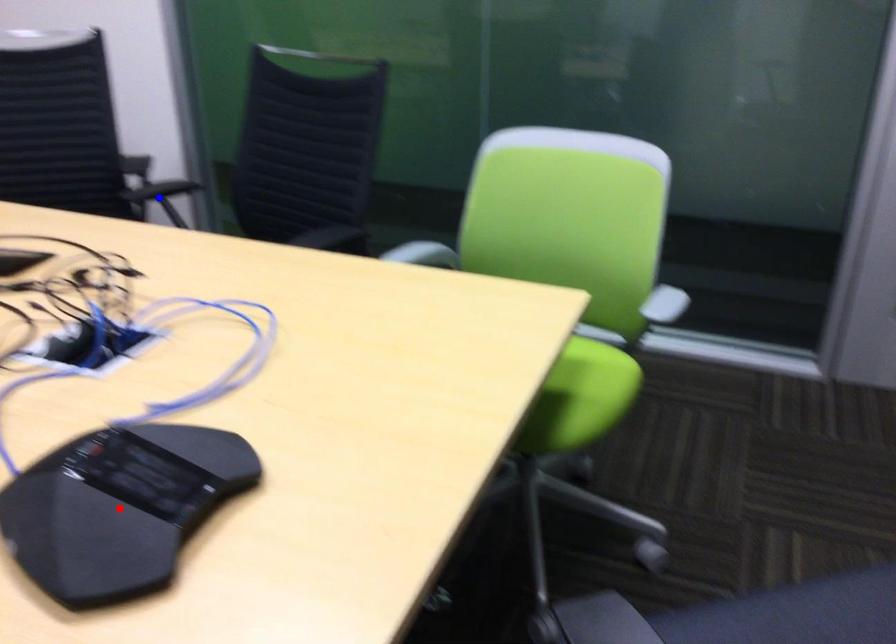
Question: Two points are marked on the image. Which point is closer to the camera?

Choices:
 (A) Blue point is closer.
 (B) Red point is closer.

Answer: (B)